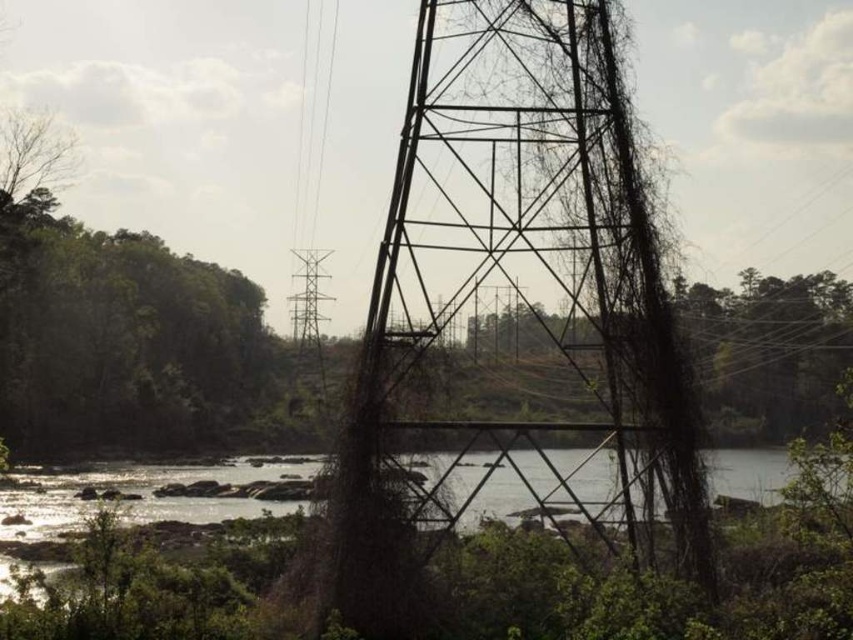
You are a bird looking for a place to rest. You see the bare branches at upper left and the metallic wire tower at center. Which one is closer to your current position if you are hovering exactly halfway between them?

Since you are hovering exactly halfway between the bare branches at upper left and the metallic wire tower at center, both are equally distant from your current position.

You are a bird looking for a place to perch. You see the rusty metal tower at center and the bare branches at upper left. Which one is closer to the ground?

The rusty metal tower at center is closer to the ground because it is positioned below the bare branches at upper left.